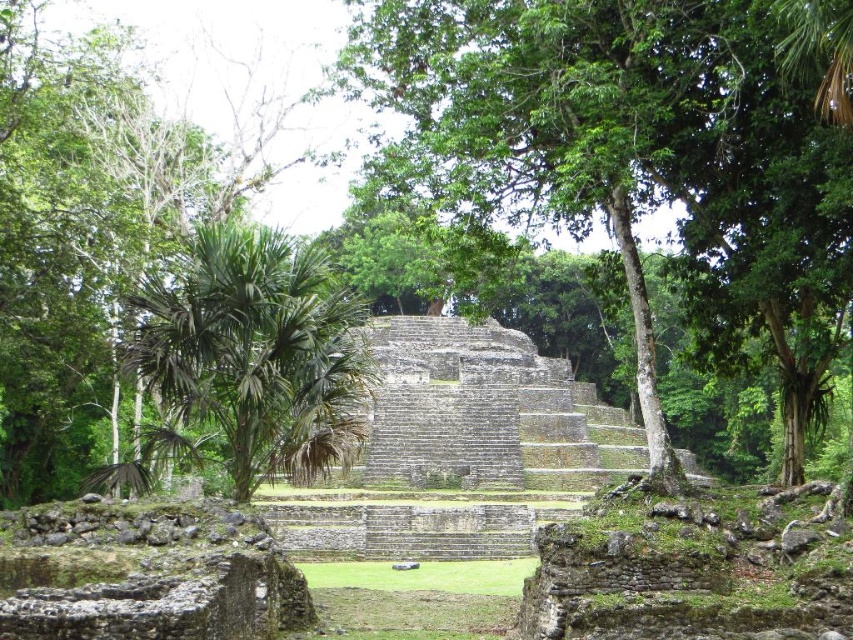
You are standing in front of the ancient stone structure and see both the green leafy tree at center and the green leafy palm tree at center. Which one is closer to you?

The green leafy tree at center is closer to you as it is positioned in front of the green leafy palm tree at center.

You are standing at the base of the pyramid and looking up. Which of the two trees, the green leafy tree at center or the green leafy palm tree at center, is positioned higher in the scene?

The green leafy tree at center is positioned higher than the green leafy palm tree at center in the scene.